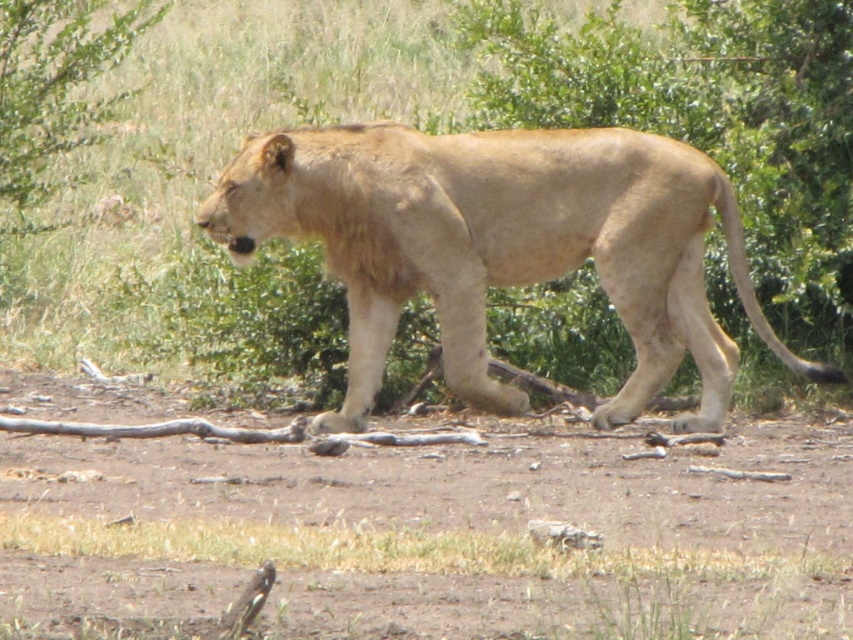
Does point (525, 577) come in front of point (38, 161)?

Yes, it is in front of point (38, 161).

Which is more to the left, brown dirt field at center or green leafy bush at upper left?

green leafy bush at upper left is more to the left.

Between point (776, 451) and point (83, 58), which one is positioned behind?

The point (83, 58) is behind.

In order to click on brown dirt field at center in this screenshot , I will do `click(438, 532)`.

Based on the photo, can you confirm if light brown fur at center is thinner than green leafy bush at upper left?

No, light brown fur at center is not thinner than green leafy bush at upper left.

Is light brown fur at center shorter than green leafy bush at upper left?

Yes.

The image size is (853, 640). I want to click on light brown fur at center, so click(502, 246).

Is brown dirt field at center smaller than light brown fur at center?

Indeed, brown dirt field at center has a smaller size compared to light brown fur at center.

Can you confirm if brown dirt field at center is positioned above light brown fur at center?

No, brown dirt field at center is not above light brown fur at center.

Image resolution: width=853 pixels, height=640 pixels. Find the location of `brown dirt field at center`. brown dirt field at center is located at coordinates [438, 532].

Identify the location of brown dirt field at center. (438, 532).